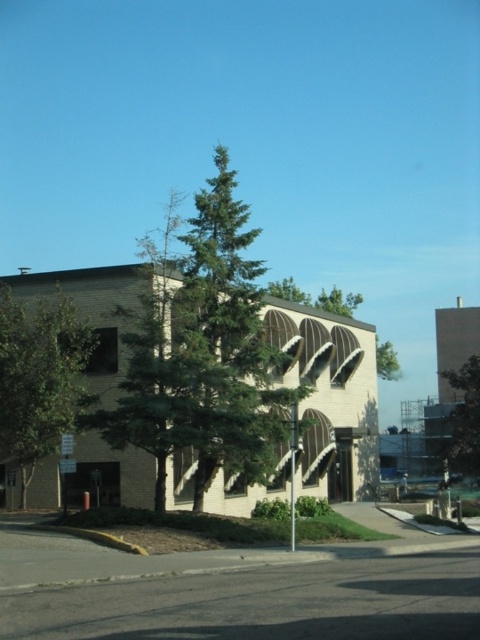
You are standing in front of the two green leafy trees. Which tree is closer to you, the green leafy tree at left or the green leafy tree at center?

The green leafy tree at left is closer to you because it is positioned in front of the green leafy tree at center.